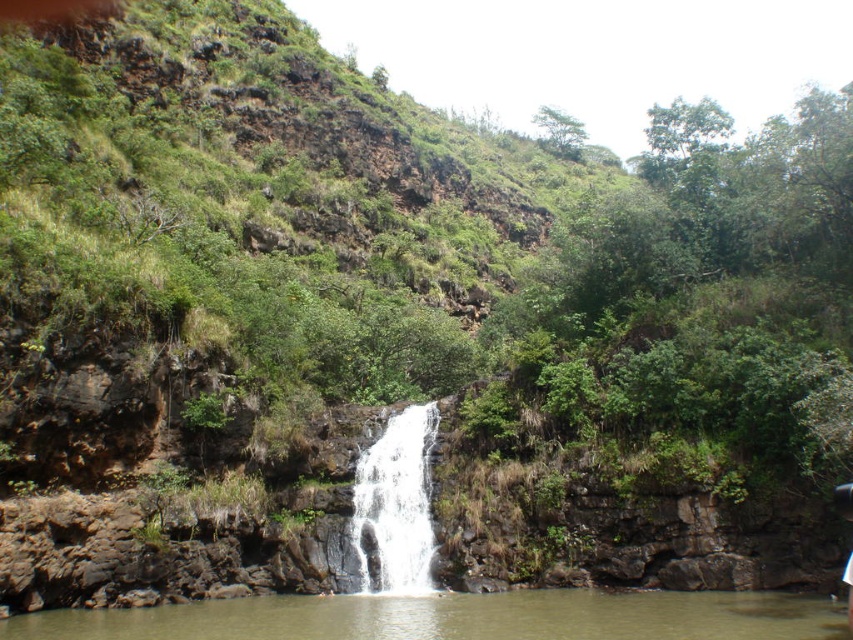
Who is more forward, [225,621] or [405,589]?

Point [225,621] is more forward.

Describe the element at coordinates (456, 618) in the screenshot. I see `green translucent water at center` at that location.

Does point (407, 625) lie in front of point (379, 460)?

Yes, point (407, 625) is closer to viewer.

I want to click on green translucent water at center, so click(456, 618).